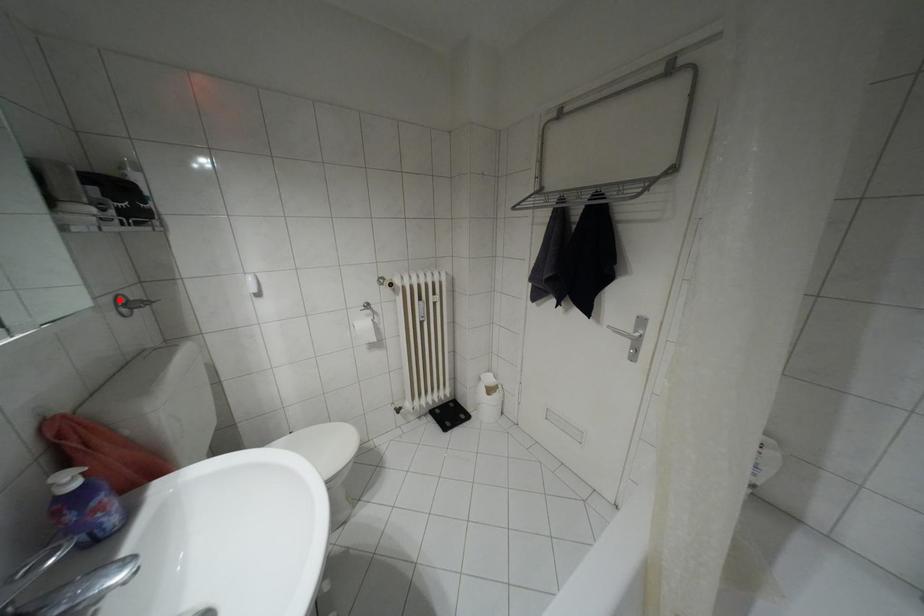
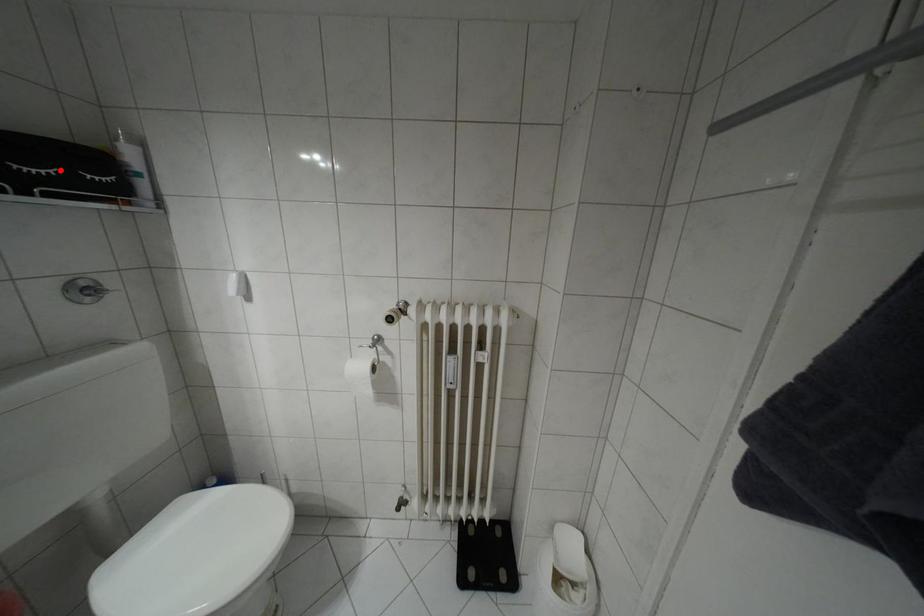
I am providing you with two images of the same scene from different viewpoints. A red point is marked on the first image and another point is marked on the second image. Do the highlighted points in image1 and image2 indicate the same real-world spot?

No